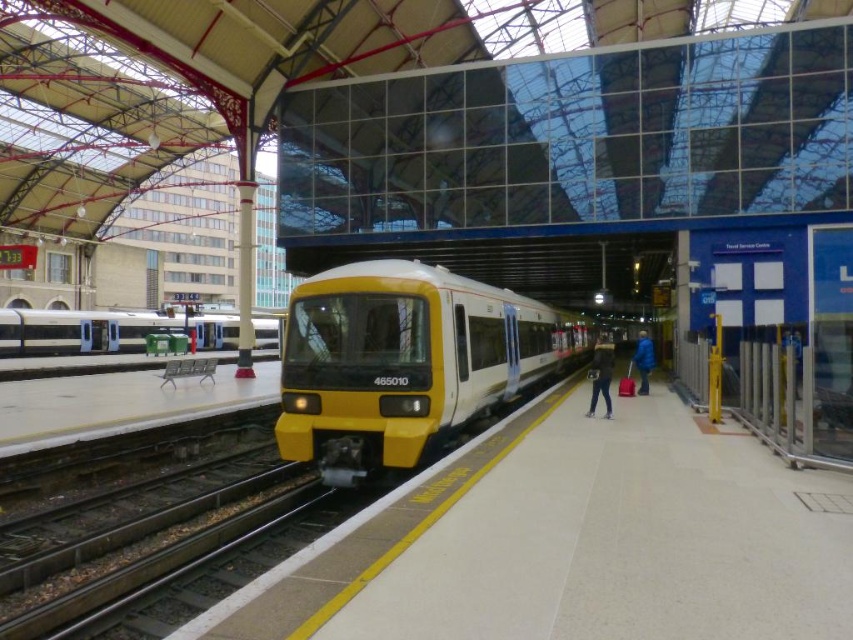
Which of these two, dark blue jacket at center or blue fabric jacket at right, stands taller?

With more height is dark blue jacket at center.

The image size is (853, 640). What do you see at coordinates (601, 372) in the screenshot? I see `dark blue jacket at center` at bounding box center [601, 372].

Image resolution: width=853 pixels, height=640 pixels. Describe the element at coordinates (601, 372) in the screenshot. I see `dark blue jacket at center` at that location.

Identify the location of dark blue jacket at center. pyautogui.click(x=601, y=372).

Image resolution: width=853 pixels, height=640 pixels. What do you see at coordinates (105, 330) in the screenshot? I see `matte silver train at left` at bounding box center [105, 330].

Consider the image. Is matte silver train at left shorter than dark blue jacket at center?

In fact, matte silver train at left may be taller than dark blue jacket at center.

Between point (225, 344) and point (606, 416), which one is positioned behind?

Positioned behind is point (225, 344).

The width and height of the screenshot is (853, 640). I want to click on matte silver train at left, so click(x=105, y=330).

Is matte silver train at left shorter than blue fabric jacket at right?

No.

The image size is (853, 640). In order to click on matte silver train at left in this screenshot , I will do `click(105, 330)`.

Is point (142, 337) closer to camera compared to point (639, 356)?

No.

I want to click on matte silver train at left, so click(x=105, y=330).